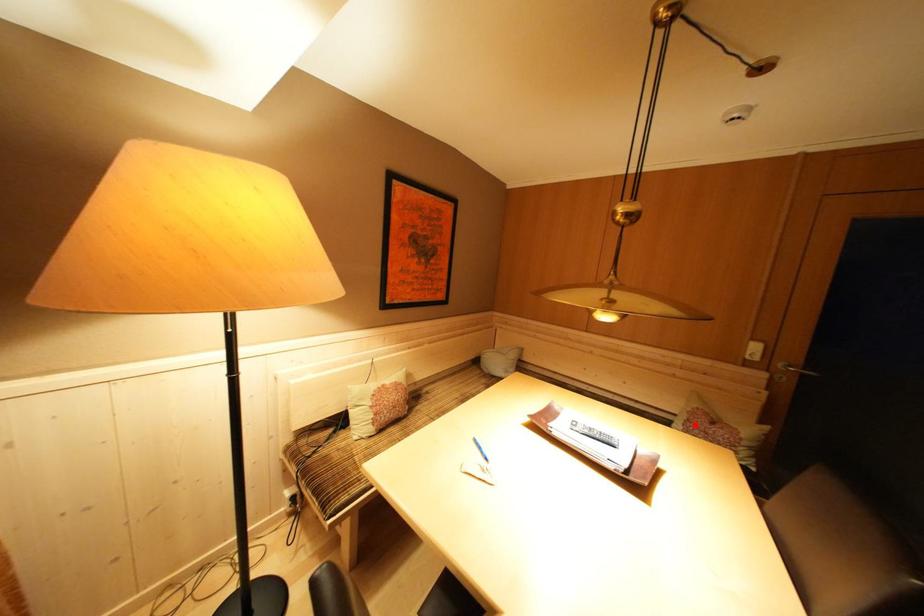
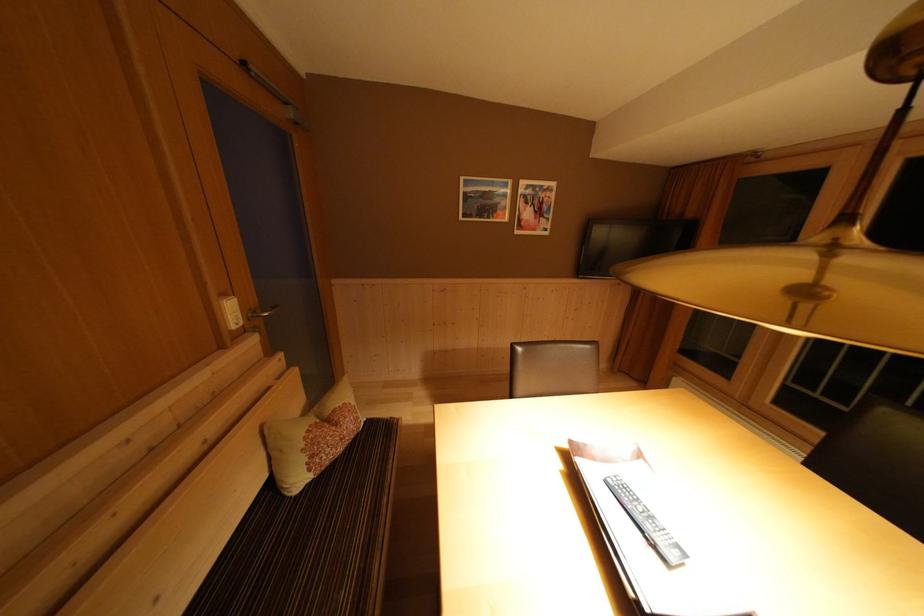
Question: I am providing you with two images of the same scene from different viewpoints. A red point is marked on the first image. Is the red point's position out of view in image 2?

Choices:
 (A) Yes
 (B) No

Answer: (B)